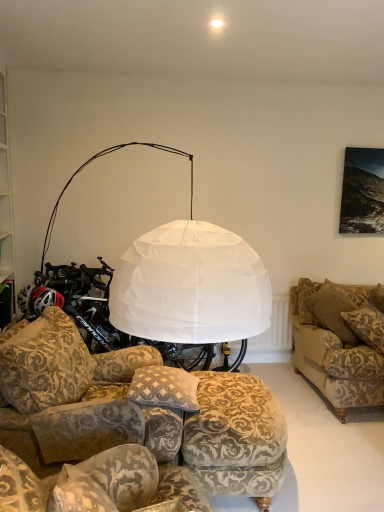
Question: From a real-world perspective, is patterned fabric footrest at lower center physically above patterned fabric couch at lower left, the 2th studio couch when ordered from back to front?

Choices:
 (A) no
 (B) yes

Answer: (A)

Question: Does patterned fabric footrest at lower center have a lesser width compared to patterned fabric couch at lower left, the second studio couch viewed from the front?

Choices:
 (A) yes
 (B) no

Answer: (B)

Question: From the image's perspective, is patterned fabric footrest at lower center beneath patterned fabric couch at lower left, positioned as the third studio couch in right-to-left order?

Choices:
 (A) no
 (B) yes

Answer: (B)

Question: Does patterned fabric footrest at lower center have a greater height compared to patterned fabric couch at lower left, the 2th studio couch when ordered from back to front?

Choices:
 (A) no
 (B) yes

Answer: (B)

Question: Is there a large distance between patterned fabric footrest at lower center and patterned fabric couch at lower left, the 2th studio couch when ordered from back to front?

Choices:
 (A) no
 (B) yes

Answer: (A)

Question: Can you confirm if patterned fabric footrest at lower center is shorter than patterned fabric couch at lower left, positioned as the third studio couch in right-to-left order?

Choices:
 (A) no
 (B) yes

Answer: (A)

Question: Is white paper lampshade at upper center surrounding patterned fabric couch at lower left, which is the first studio couch in left-to-right order?

Choices:
 (A) yes
 (B) no

Answer: (B)

Question: From a real-world perspective, is white paper lampshade at upper center beneath patterned fabric couch at lower left, the 2th studio couch when ordered from back to front?

Choices:
 (A) no
 (B) yes

Answer: (A)

Question: Considering the relative sizes of white paper lampshade at upper center and patterned fabric couch at lower left, positioned as the third studio couch in right-to-left order, in the image provided, is white paper lampshade at upper center taller than patterned fabric couch at lower left, positioned as the third studio couch in right-to-left order,?

Choices:
 (A) yes
 (B) no

Answer: (B)

Question: Considering the relative sizes of white paper lampshade at upper center and patterned fabric couch at lower left, which is the first studio couch in left-to-right order, in the image provided, is white paper lampshade at upper center smaller than patterned fabric couch at lower left, which is the first studio couch in left-to-right order,?

Choices:
 (A) no
 (B) yes

Answer: (B)

Question: Is white paper lampshade at upper center to the left of patterned fabric couch at lower left, the 2th studio couch when ordered from back to front, from the viewer's perspective?

Choices:
 (A) no
 (B) yes

Answer: (A)

Question: Does white paper lampshade at upper center come in front of patterned fabric couch at lower left, which is the first studio couch in left-to-right order?

Choices:
 (A) yes
 (B) no

Answer: (B)

Question: Is velvet-patterned couch at right, which is counted as the first studio couch, starting from the right, to the left of patterned fabric footrest at lower center from the viewer's perspective?

Choices:
 (A) no
 (B) yes

Answer: (A)